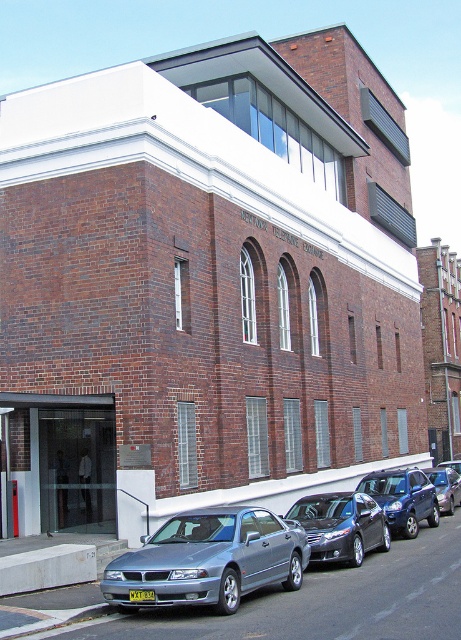
Question: Does concrete at lower left have a larger size compared to satin black suv at center?

Choices:
 (A) yes
 (B) no

Answer: (B)

Question: Which object appears farthest from the camera in this image?

Choices:
 (A) metallic silver sedan at center
 (B) yellow matte license plate at center
 (C) satin silver sedan at lower center

Answer: (A)

Question: Which of the following is the closest to the observer?

Choices:
 (A) satin silver sedan at lower center
 (B) concrete at lower left

Answer: (A)

Question: Among these points, which one is farthest from the camera?

Choices:
 (A) (130, 595)
 (B) (449, 486)

Answer: (B)

Question: Considering the relative positions of concrete at lower left and yellow matte license plate at center in the image provided, where is concrete at lower left located with respect to yellow matte license plate at center?

Choices:
 (A) above
 (B) below

Answer: (B)

Question: Is satin black suv at center below yellow matte license plate at center?

Choices:
 (A) no
 (B) yes

Answer: (B)